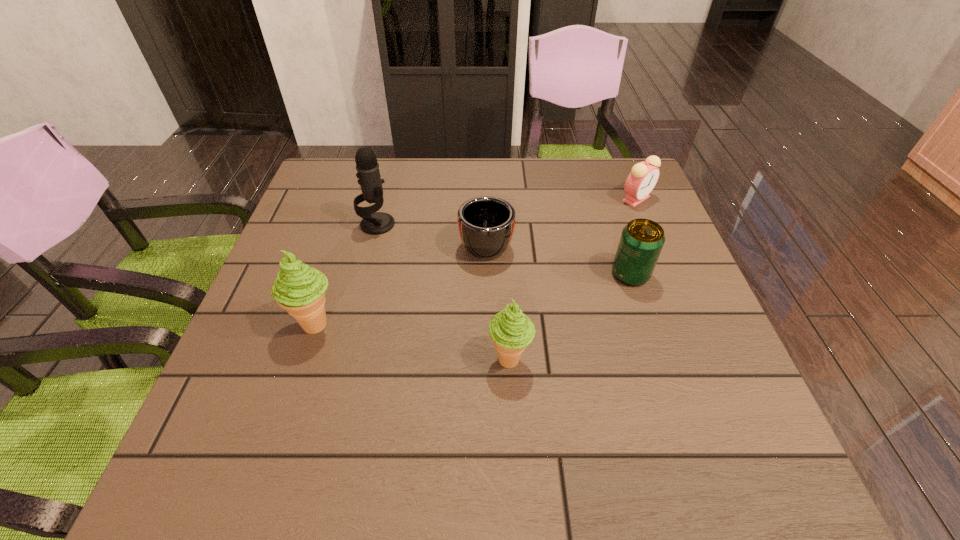
The image size is (960, 540). What are the coordinates of `vacant space that satisfies the following two spatial constraints: 1. on the back side of the microphone; 2. on the right side of the taller icecream` in the screenshot? It's located at (348, 224).